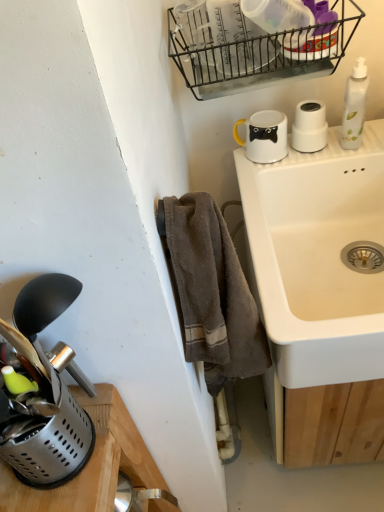
This screenshot has height=512, width=384. Identify the location of free spot to the right of white glossy mug at upper center, which appears as the 2th appliance when viewed from the front. (337, 148).